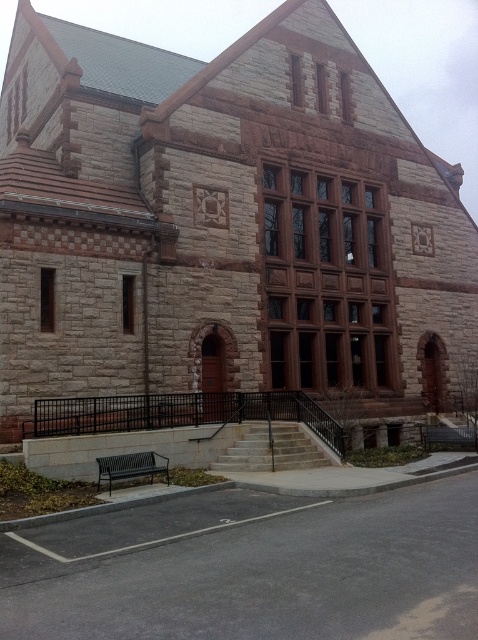
You are standing in a park and see the brown stone church at center and the black metal bench at lower left. Which object is positioned to the right of the other?

The brown stone church at center is positioned to the right of the black metal bench at lower left.

You are standing in front of a historic stone building. There is a point marked at coordinates (x=224, y=221). What does this point indicate?

The point at coordinates (x=224, y=221) indicates the brown stone church at center.

You are standing in a park and see the brown stone church at center and the black metal bench at lower left. If you want to walk towards the building, which object will you pass first?

You will pass the black metal bench at lower left first because it is closer to you than the brown stone church at center, which is further away.